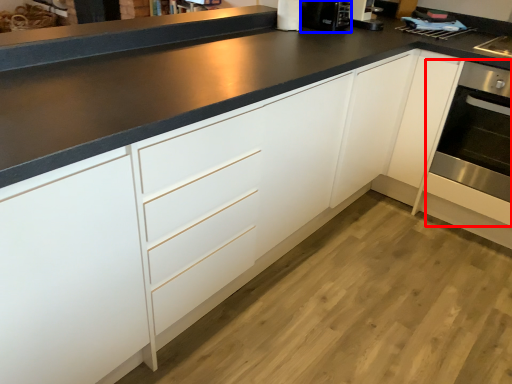
Question: Which point is further to the camera, oven (highlighted by a red box) or coffee machine (highlighted by a blue box)?

Choices:
 (A) oven
 (B) coffee machine

Answer: (B)